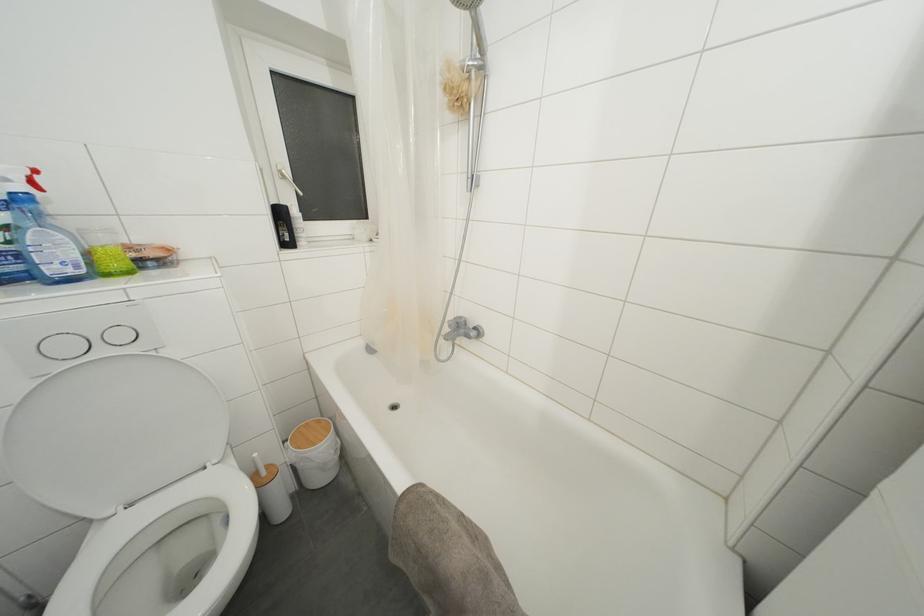
Find where to lift the wooden trash can lid. Please return your answer as a coordinate pair (x, y).

(312, 432)